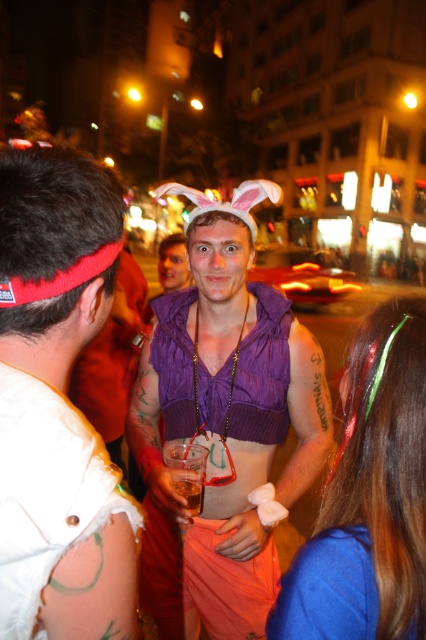
Question: Can you confirm if purple knitted vest at center is positioned to the right of purple fabric vest at center?

Choices:
 (A) no
 (B) yes

Answer: (B)

Question: Which object is the closest to the shiny blue hairband at center?

Choices:
 (A) blue fabric at lower right
 (B) purple fabric vest at center
 (C) translucent plastic cup at center

Answer: (A)

Question: Can you confirm if purple knitted vest at center is positioned to the left of purple fabric vest at center?

Choices:
 (A) no
 (B) yes

Answer: (A)

Question: Which point appears closest to the camera in this image?

Choices:
 (A) (331, 634)
 (B) (49, 381)
 (C) (385, 412)

Answer: (B)

Question: Among these points, which one is nearest to the camera?

Choices:
 (A) (244, 461)
 (B) (376, 464)
 (C) (325, 561)
 (D) (92, 509)

Answer: (D)

Question: Observing the image, what is the correct spatial positioning of purple fabric vest at center in reference to blue fabric at lower right?

Choices:
 (A) below
 (B) above

Answer: (B)